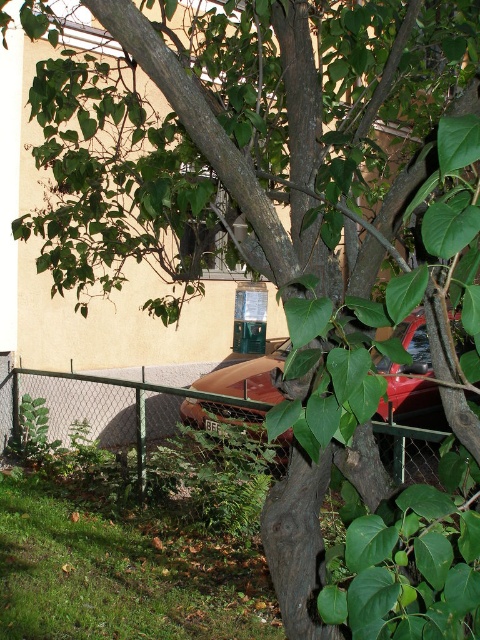
Does point (64, 397) come behind point (213, 408)?

Yes, it is.

Can you confirm if green chain-link fence at lower center is positioned to the left of rusty metal car at center?

Indeed, green chain-link fence at lower center is positioned on the left side of rusty metal car at center.

Which is in front, point (122, 396) or point (457, 326)?

Positioned in front is point (457, 326).

The width and height of the screenshot is (480, 640). Identify the location of green chain-link fence at lower center. (98, 404).